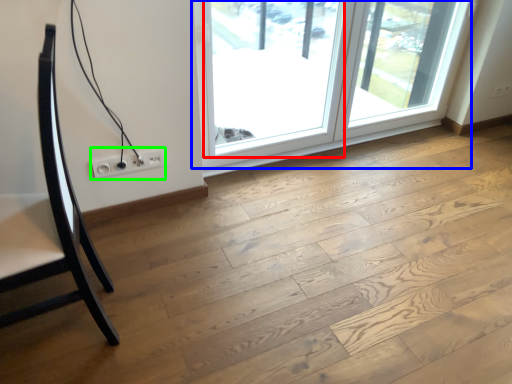
Question: Which is nearer to the window (highlighted by a red box)? window (highlighted by a blue box) or electric outlet (highlighted by a green box).

Choices:
 (A) window
 (B) electric outlet

Answer: (A)